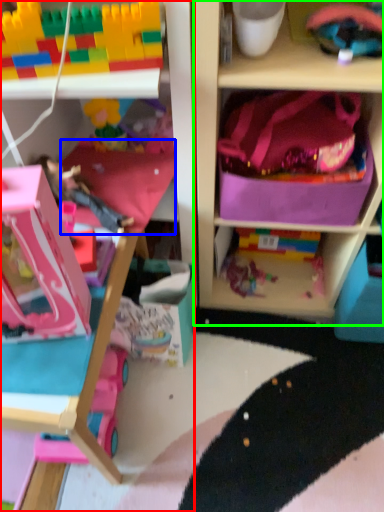
Question: Estimate the real-world distances between objects in this image. Which object is farther from cabinetry (highlighted by a red box), pillow (highlighted by a blue box) or shelf (highlighted by a green box)?

Choices:
 (A) pillow
 (B) shelf

Answer: (B)